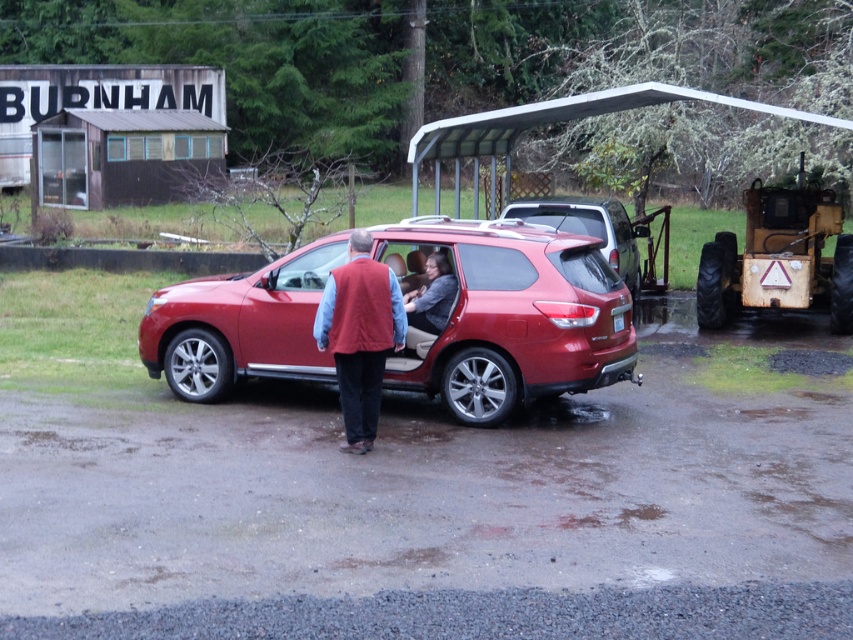
Question: Observing the image, what is the correct spatial positioning of red wool vest at center in reference to matte gray sweater at center?

Choices:
 (A) above
 (B) below

Answer: (B)

Question: Which of these objects is positioned farthest from the shiny metallic suv at center?

Choices:
 (A) glossy red minivan at center
 (B) red wool vest at center

Answer: (A)

Question: Can you confirm if red wool vest at center is positioned below glossy red minivan at center?

Choices:
 (A) yes
 (B) no

Answer: (A)

Question: Which object is closer to the camera taking this photo?

Choices:
 (A) glossy red minivan at center
 (B) shiny metallic suv at center

Answer: (B)

Question: Does red wool vest at center have a smaller size compared to matte gray sweater at center?

Choices:
 (A) yes
 (B) no

Answer: (B)

Question: Which object is farther from the camera taking this photo?

Choices:
 (A) matte gray sweater at center
 (B) red wool vest at center
 (C) glossy red minivan at center

Answer: (C)